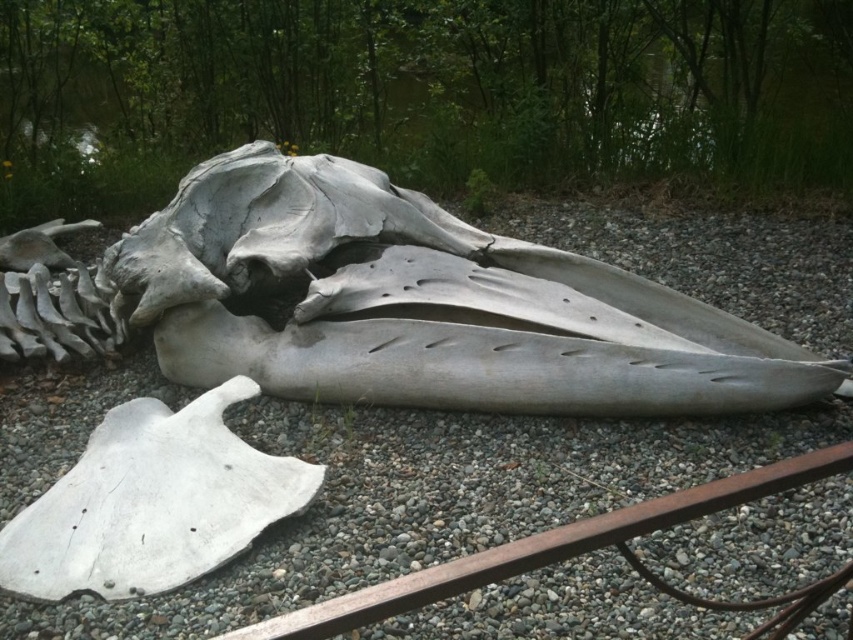
Is point (693, 268) farther from viewer compared to point (215, 294)?

Yes, point (693, 268) is behind point (215, 294).

Find the location of a particular element. This screenshot has height=640, width=853. gray gravel at center is located at coordinates (427, 500).